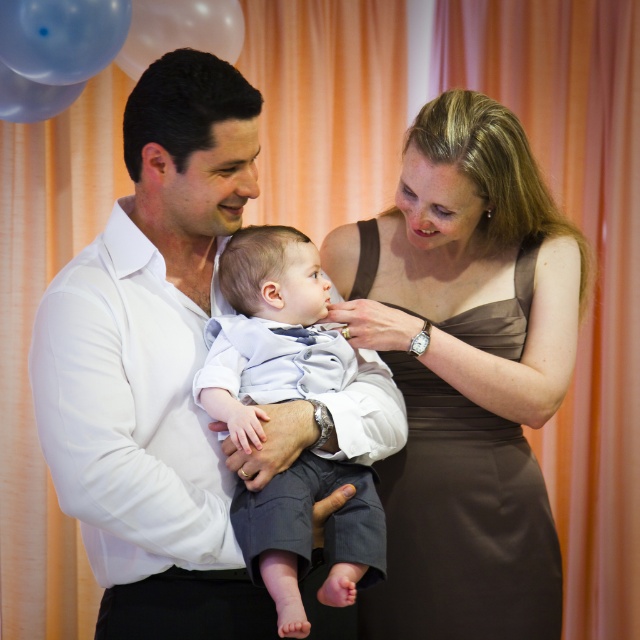
Question: Which point appears farthest from the camera in this image?

Choices:
 (A) (65, 104)
 (B) (208, 624)

Answer: (A)

Question: Which object is farther from the camera taking this photo?

Choices:
 (A) transparent plastic balloon at upper left
 (B) light blue cotton shirt at center
 (C) brown satin dress at center
 (D) translucent blue balloon at upper left

Answer: (D)

Question: Is brown satin dress at center to the left of translucent blue balloon at upper left from the viewer's perspective?

Choices:
 (A) no
 (B) yes

Answer: (A)

Question: Is white smooth shirt at center positioned at the back of light blue cotton shirt at center?

Choices:
 (A) no
 (B) yes

Answer: (B)

Question: Considering the relative positions of brown satin dress at center and translucent blue balloon at upper left in the image provided, where is brown satin dress at center located with respect to translucent blue balloon at upper left?

Choices:
 (A) below
 (B) above

Answer: (A)

Question: Which of the following is the farthest from the observer?

Choices:
 (A) (122, 29)
 (B) (136, 58)

Answer: (B)